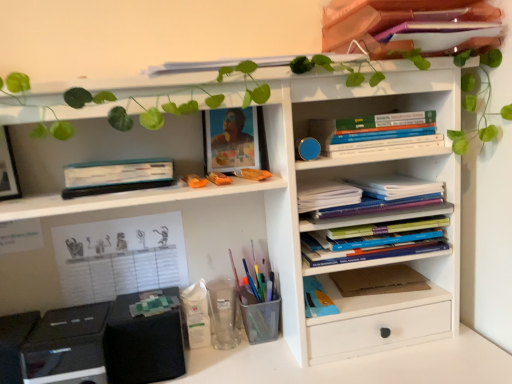
Question: Does point (244, 259) appear closer or farther from the camera than point (328, 18)?

Choices:
 (A) farther
 (B) closer

Answer: (A)

Question: In terms of height, does metal mesh pen holder at lower center, which is the third stationery in left-to-right order, look taller or shorter compared to matte pink book at upper right, which appears as the first book when viewed from the top?

Choices:
 (A) tall
 (B) short

Answer: (A)

Question: Considering the real-world distances, which object is closest to the transparent plastic cup at lower center, which is the 2th stationery in left-to-right order?

Choices:
 (A) metal mesh pen holder at lower center, which is the third stationery in left-to-right order
 (B) white matte plastic container at lower center, the 3th stationery positioned from the right
 (C) matte plastic picture frame at upper center
 (D) brown cardboard at center-right, which is the 3th paperback book in top-to-bottom order
 (E) hardcover books at center right, the second book when ordered from top to bottom

Answer: (B)

Question: Which object is the closest to the white paper notebook at center right, the second book ordered from the bottom?

Choices:
 (A) brown cardboard at center-right, which is the 3th paperback book in top-to-bottom order
 (B) matte pink book at upper right, marked as the 4th book in a bottom-to-top arrangement
 (C) white paper at left, arranged as the 2th paperback book when ordered from the bottom
 (D) black matte speaker at lower left
 (E) transparent plastic cup at lower center, which is the 2th stationery from right to left

Answer: (A)